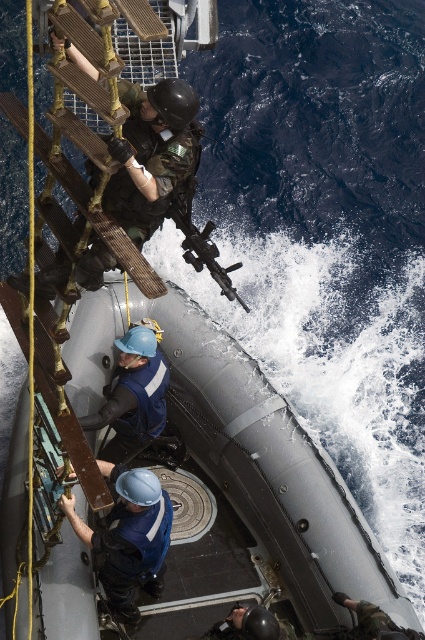
Is blue hard hat at center bigger than shiny black helmet at lower center?

Indeed, blue hard hat at center has a larger size compared to shiny black helmet at lower center.

Does point (144, 556) lie behind point (248, 604)?

That is False.

The image size is (425, 640). Describe the element at coordinates (129, 538) in the screenshot. I see `blue hard hat at center` at that location.

Image resolution: width=425 pixels, height=640 pixels. Find the location of `blue hard hat at center`. blue hard hat at center is located at coordinates (129, 538).

Between matte black rifle at center and shiny black helmet at lower center, which one is positioned higher?

Positioned higher is matte black rifle at center.

Is point (189, 221) farther from camera compared to point (218, 634)?

That is True.

You are a GUI agent. You are given a task and a screenshot of the screen. Output one action in this format:
    pyautogui.click(x=<x>, y=<y>)
    Task: Click on the matte black rifle at center
    Image resolution: width=425 pixels, height=640 pixels.
    Given the screenshot: What is the action you would take?
    pyautogui.click(x=201, y=243)

Does blue hard hat at center appear on the right side of matte black rifle at center?

In fact, blue hard hat at center is to the left of matte black rifle at center.

Measure the distance between point (169, 509) and camera.

Point (169, 509) is 6.79 meters from camera.

This screenshot has width=425, height=640. In order to click on blue hard hat at center in this screenshot , I will do `click(129, 538)`.